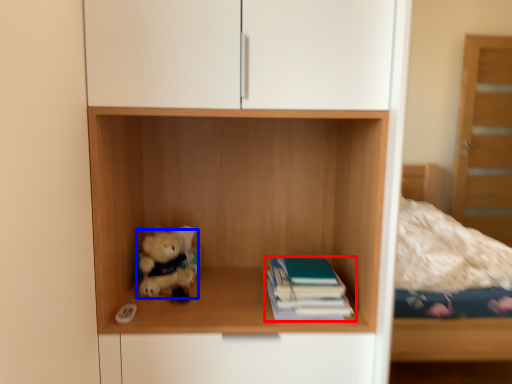
Question: Which object appears closest to the camera in this image, book (highlighted by a red box) or teddy bear (highlighted by a blue box)?

Choices:
 (A) book
 (B) teddy bear

Answer: (A)